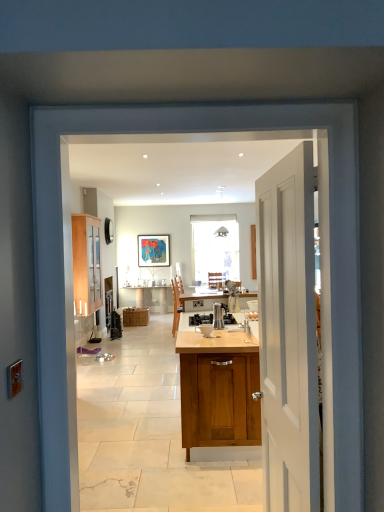
Question: Does metallic stainless steel coffee maker at center turn towards white painted wood door at right?

Choices:
 (A) no
 (B) yes

Answer: (A)

Question: Considering the relative sizes of metallic stainless steel coffee maker at center and white painted wood door at right in the image provided, is metallic stainless steel coffee maker at center smaller than white painted wood door at right?

Choices:
 (A) yes
 (B) no

Answer: (A)

Question: Can we say metallic stainless steel coffee maker at center lies outside white painted wood door at right?

Choices:
 (A) yes
 (B) no

Answer: (A)

Question: Considering the relative sizes of metallic stainless steel coffee maker at center and white painted wood door at right in the image provided, is metallic stainless steel coffee maker at center shorter than white painted wood door at right?

Choices:
 (A) yes
 (B) no

Answer: (A)

Question: Does metallic stainless steel coffee maker at center have a lesser width compared to white painted wood door at right?

Choices:
 (A) yes
 (B) no

Answer: (B)

Question: Is metallic stainless steel coffee maker at center at the left side of white painted wood door at right?

Choices:
 (A) no
 (B) yes

Answer: (B)

Question: Considering the relative positions of satin silver coffee maker at center and wooden cabinet at left, which is the 2th cabinetry in right-to-left order, in the image provided, is satin silver coffee maker at center to the right of wooden cabinet at left, which is the 2th cabinetry in right-to-left order, from the viewer's perspective?

Choices:
 (A) no
 (B) yes

Answer: (B)

Question: Would you say satin silver coffee maker at center is outside wooden cabinet at left, placed as the second cabinetry when sorted from bottom to top?

Choices:
 (A) yes
 (B) no

Answer: (A)

Question: Does satin silver coffee maker at center lie in front of wooden cabinet at left, which appears as the first cabinetry when viewed from the top?

Choices:
 (A) no
 (B) yes

Answer: (B)

Question: Is satin silver coffee maker at center shorter than wooden cabinet at left, which appears as the 1th cabinetry when viewed from the left?

Choices:
 (A) yes
 (B) no

Answer: (A)

Question: Is satin silver coffee maker at center to the left of wooden cabinet at left, which appears as the first cabinetry when viewed from the top, from the viewer's perspective?

Choices:
 (A) yes
 (B) no

Answer: (B)

Question: From a real-world perspective, does satin silver coffee maker at center sit lower than wooden cabinet at left, marked as the second cabinetry in a back-to-front arrangement?

Choices:
 (A) no
 (B) yes

Answer: (B)

Question: Is wooden cabinet at left, which appears as the 1th cabinetry when viewed from the left, at the left side of metallic stainless steel coffee maker at center?

Choices:
 (A) yes
 (B) no

Answer: (A)